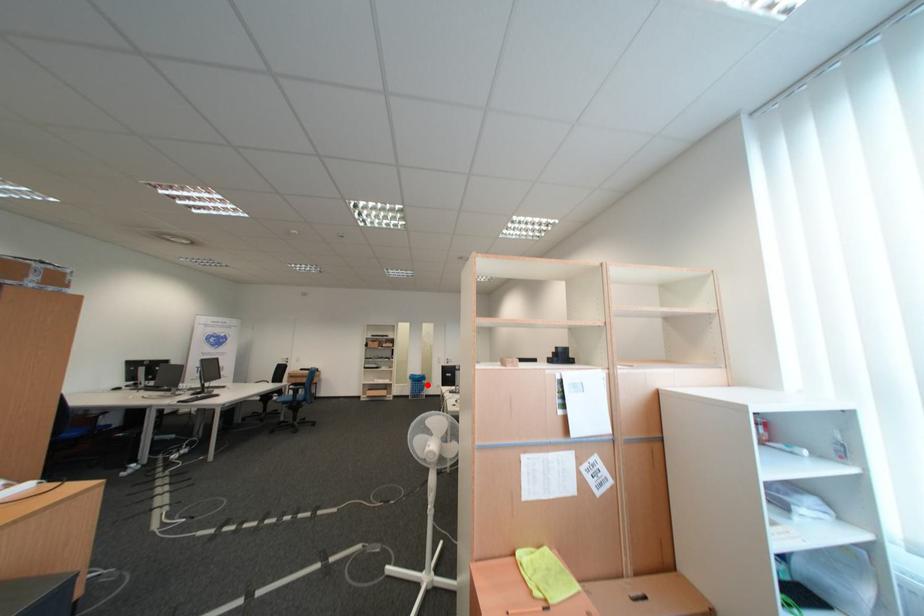
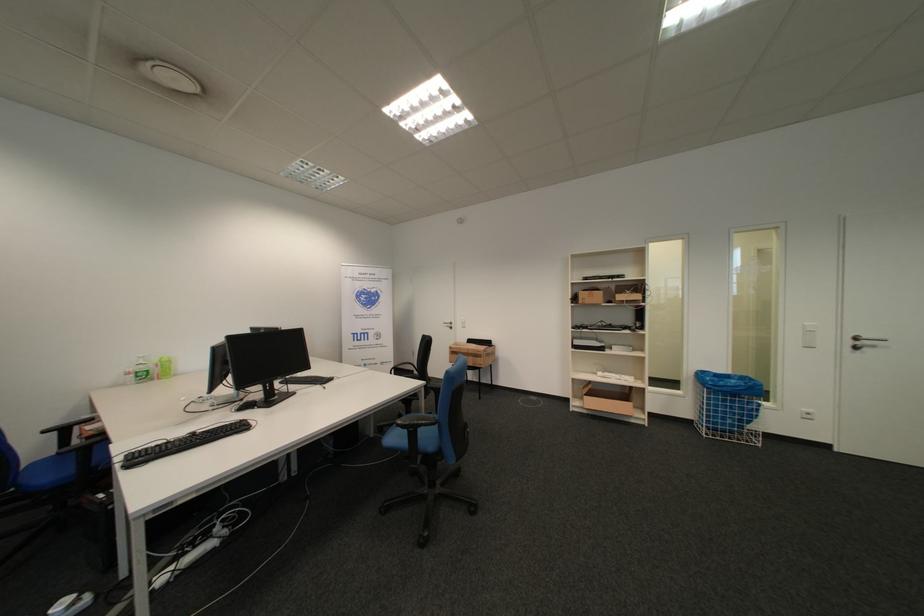
Question: I am providing you with two images of the same scene from different viewpoints. Given a red point in image1, look at the same physical point in image2. Is it:

Choices:
 (A) Closer to the viewpoint
 (B) Farther from the viewpoint

Answer: (A)